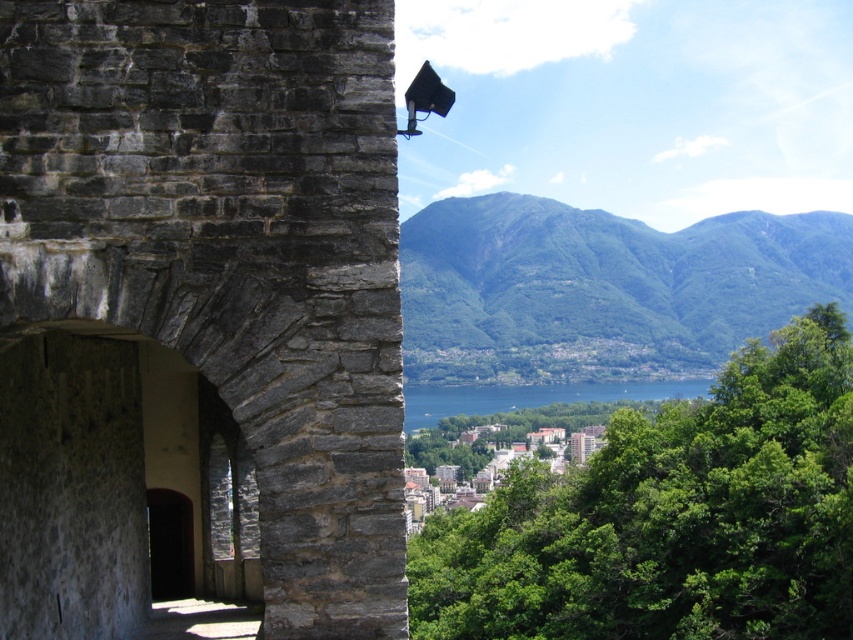
I want to click on gray stone arch at center, so click(199, 314).

Who is more forward, (267, 582) or (589, 385)?

Point (267, 582) is more forward.

Which of these two, gray stone arch at center or blue water at center, stands shorter?

gray stone arch at center

Does point (21, 387) come closer to viewer compared to point (549, 396)?

Yes, point (21, 387) is closer to viewer.

Find the location of a particular element. gray stone arch at center is located at coordinates (199, 314).

This screenshot has width=853, height=640. What do you see at coordinates (671, 516) in the screenshot?
I see `green leafy tree at center` at bounding box center [671, 516].

Measure the distance between point (570, 548) and camera.

A distance of 209.62 feet exists between point (570, 548) and camera.

Where is `green leafy tree at center`? green leafy tree at center is located at coordinates (671, 516).